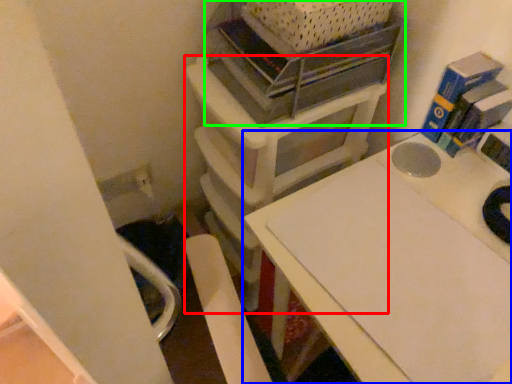
Question: Which is farther away from furniture (highlighted by a red box)? table (highlighted by a blue box) or shelf (highlighted by a green box)?

Choices:
 (A) table
 (B) shelf

Answer: (A)